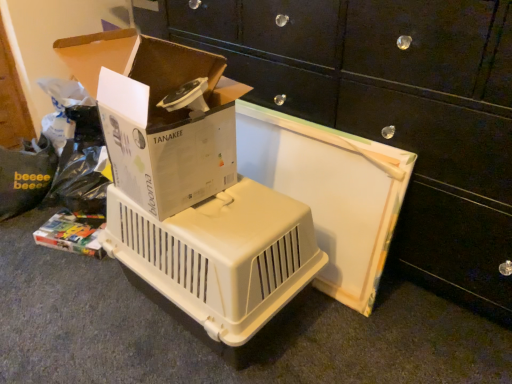
Question: Is white cardboard box at upper left oriented towards white plastic pet carrier at center?

Choices:
 (A) yes
 (B) no

Answer: (B)

Question: Does white cardboard box at upper left lie behind white plastic pet carrier at center?

Choices:
 (A) no
 (B) yes

Answer: (B)

Question: From a real-world perspective, is white cardboard box at upper left on white plastic pet carrier at center?

Choices:
 (A) yes
 (B) no

Answer: (A)

Question: Is white cardboard box at upper left oriented away from white plastic pet carrier at center?

Choices:
 (A) yes
 (B) no

Answer: (A)

Question: Is white cardboard box at upper left wider than white plastic pet carrier at center?

Choices:
 (A) yes
 (B) no

Answer: (B)

Question: Does white cardboard box at upper left appear on the left side of white plastic pet carrier at center?

Choices:
 (A) yes
 (B) no

Answer: (A)

Question: From a real-world perspective, is white plastic pet carrier at center positioned over beige plastic pet carrier at center based on gravity?

Choices:
 (A) no
 (B) yes

Answer: (B)

Question: Is white plastic pet carrier at center far away from beige plastic pet carrier at center?

Choices:
 (A) no
 (B) yes

Answer: (A)

Question: Is white plastic pet carrier at center beside beige plastic pet carrier at center?

Choices:
 (A) yes
 (B) no

Answer: (B)

Question: Is white plastic pet carrier at center to the right of beige plastic pet carrier at center from the viewer's perspective?

Choices:
 (A) yes
 (B) no

Answer: (A)

Question: Can you confirm if white plastic pet carrier at center is shorter than beige plastic pet carrier at center?

Choices:
 (A) no
 (B) yes

Answer: (A)

Question: Is white plastic pet carrier at center taller than beige plastic pet carrier at center?

Choices:
 (A) no
 (B) yes

Answer: (B)

Question: Considering the relative sizes of white cardboard box at upper left and beige plastic pet carrier at center in the image provided, is white cardboard box at upper left shorter than beige plastic pet carrier at center?

Choices:
 (A) yes
 (B) no

Answer: (A)